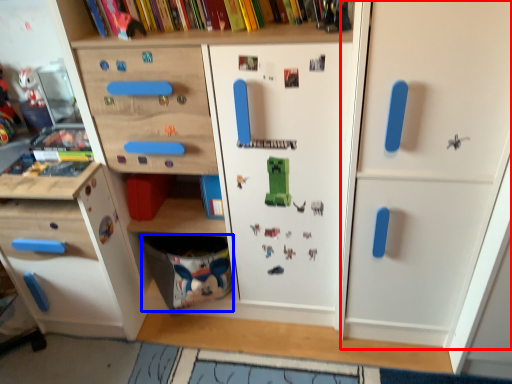
Question: Which of the following is the farthest to the observer, door (highlighted by a red box) or drawer (highlighted by a blue box)?

Choices:
 (A) door
 (B) drawer

Answer: (B)